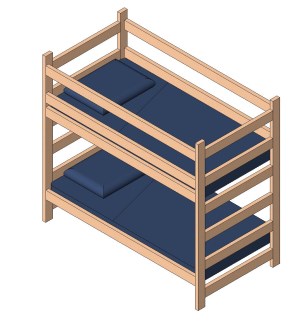
Locate an element on the screen. The image size is (289, 330). pillow is located at coordinates (130, 84).